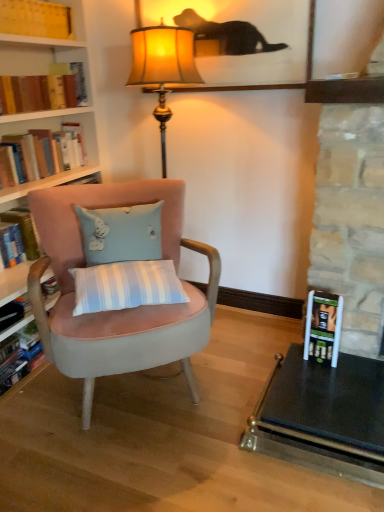
At what (x,y) coordinates should I click in order to perform the action: click on vacant space in velvet pink chair at center (from a real-world perspective). Please return your answer as a coordinate pair (x, y). Looking at the image, I should click on (136, 394).